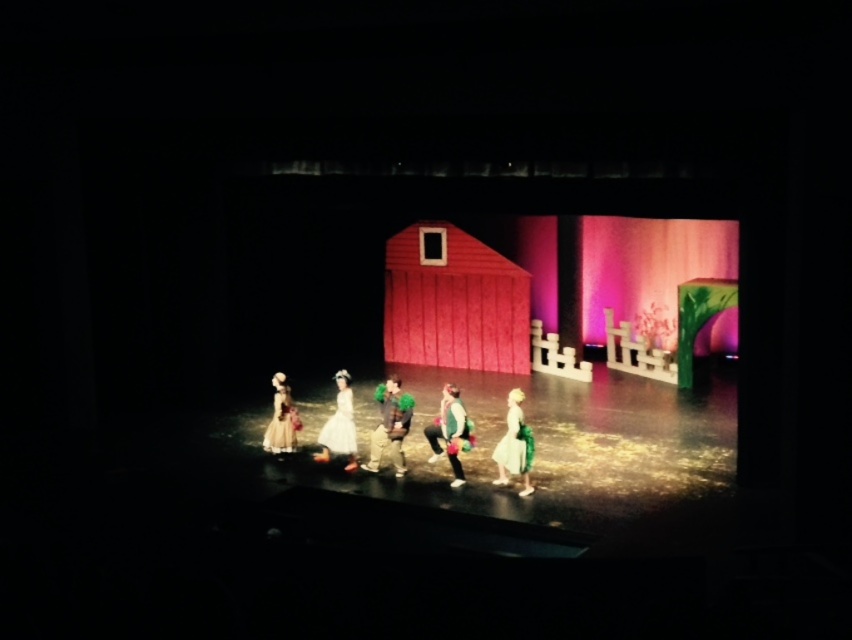
Question: Which point is closer to the camera taking this photo?

Choices:
 (A) (389, 436)
 (B) (285, 412)

Answer: (A)

Question: Based on their relative distances, which object is farther from the green fabric dress at center?

Choices:
 (A) white satin dress at center
 (B) matte yellow dress at lower left
 (C) green fuzzy hat at center
 (D) matte white dress at center

Answer: (B)

Question: Considering the relative positions of green fabric dress at center and matte yellow dress at lower left in the image provided, where is green fabric dress at center located with respect to matte yellow dress at lower left?

Choices:
 (A) below
 (B) above

Answer: (A)

Question: Which point appears farthest from the camera in this image?

Choices:
 (A) (517, 410)
 (B) (346, 390)
 (C) (285, 403)
 (D) (446, 451)

Answer: (C)

Question: Does green fuzzy hat at center appear on the right side of green fabric dress at center?

Choices:
 (A) yes
 (B) no

Answer: (B)

Question: Where is green fabric dress at center located in relation to matte yellow dress at lower left in the image?

Choices:
 (A) above
 (B) below

Answer: (B)